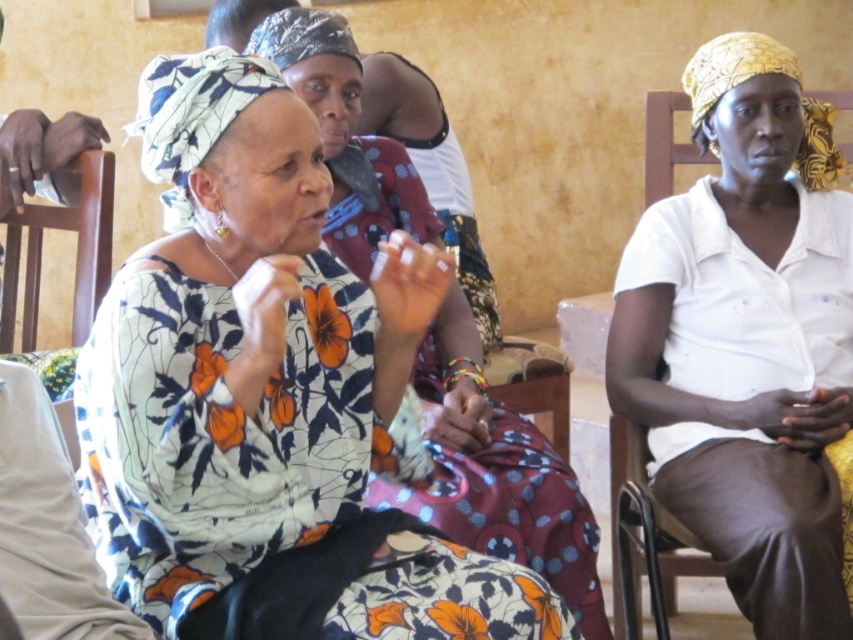
Question: Does white cotton shirt at center appear on the right side of wooden chair at left?

Choices:
 (A) yes
 (B) no

Answer: (A)

Question: Among these objects, which one is nearest to the camera?

Choices:
 (A) wooden chair at left
 (B) white cotton shirt at center
 (C) floral print dress at center

Answer: (C)

Question: Is white cotton shirt at center to the right of wooden chair at left from the viewer's perspective?

Choices:
 (A) yes
 (B) no

Answer: (A)

Question: Which of the following is the farthest from the observer?

Choices:
 (A) (300, 104)
 (B) (668, 493)

Answer: (B)

Question: Estimate the real-world distances between objects in this image. Which object is farther from the white cotton shirt at center?

Choices:
 (A) wooden chair at left
 (B) floral print dress at center

Answer: (A)

Question: Can you confirm if floral print dress at center is positioned to the left of white cotton shirt at center?

Choices:
 (A) yes
 (B) no

Answer: (A)